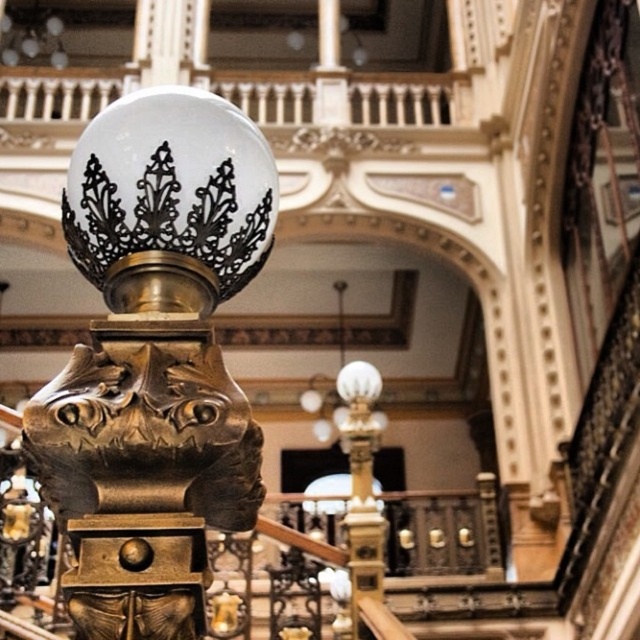
Question: Is matte gold sculpture at center smaller than gold polished metal lamp post at center?

Choices:
 (A) yes
 (B) no

Answer: (A)

Question: From the image, what is the correct spatial relationship of matte gold sculpture at center in relation to gold polished metal lamp post at center?

Choices:
 (A) below
 (B) above

Answer: (B)

Question: From the image, what is the correct spatial relationship of matte gold sculpture at center in relation to gold polished metal lamp post at center?

Choices:
 (A) below
 (B) above

Answer: (B)

Question: Among these objects, which one is farthest from the camera?

Choices:
 (A) matte gold sculpture at center
 (B) gold polished metal lamp post at center

Answer: (B)